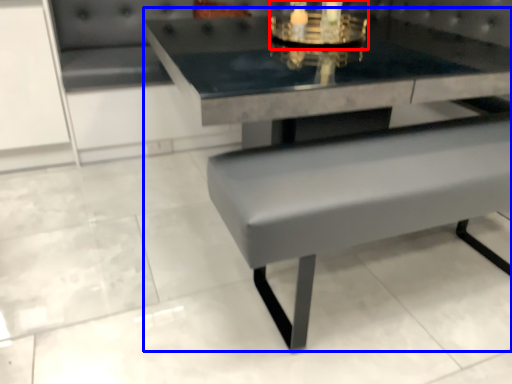
Question: Among these objects, which one is nearest to the camera, candle holder (highlighted by a red box) or picnic table (highlighted by a blue box)?

Choices:
 (A) candle holder
 (B) picnic table

Answer: (B)